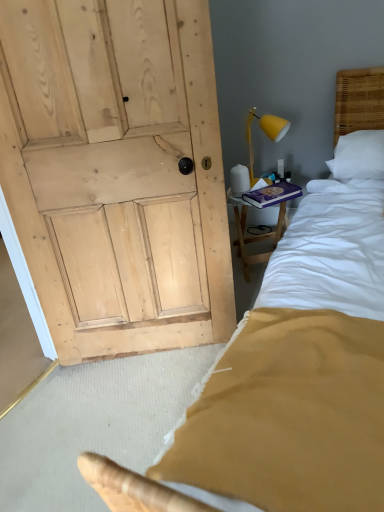
Measure the distance between point (300, 190) and camera.

Point (300, 190) and camera are 7.04 feet apart from each other.

The width and height of the screenshot is (384, 512). Find the location of `wooden bedside table at right`. wooden bedside table at right is located at coordinates (262, 232).

Identify the location of yellow matte lamp at upper right. The width and height of the screenshot is (384, 512). (x=265, y=133).

Where is `purple hardcover book at upper right`? The width and height of the screenshot is (384, 512). purple hardcover book at upper right is located at coordinates (272, 194).

Does point (289, 195) come in front of point (266, 182)?

Yes, it is.

Considering the relative sizes of purple hardcover book at upper right and yellow matte lamp at upper right in the image provided, is purple hardcover book at upper right bigger than yellow matte lamp at upper right?

Actually, purple hardcover book at upper right might be smaller than yellow matte lamp at upper right.

Is purple hardcover book at upper right at the right side of yellow matte lamp at upper right?

Yes, purple hardcover book at upper right is to the right of yellow matte lamp at upper right.

Is yellow matte lamp at upper right completely or partially inside purple hardcover book at upper right?

No.

In order to click on bedside lamp above the wooden bedside table at right (from a real-world perspective) in this screenshot , I will do `click(265, 133)`.

Which is more to the left, yellow matte lamp at upper right or wooden bedside table at right?

From the viewer's perspective, yellow matte lamp at upper right appears more on the left side.

Is the depth of yellow matte lamp at upper right less than that of wooden bedside table at right?

Yes, it is in front of wooden bedside table at right.

Does wooden bedside table at right turn towards yellow matte lamp at upper right?

No, wooden bedside table at right is not oriented towards yellow matte lamp at upper right.

From a real-world perspective, which is physically below, wooden bedside table at right or yellow matte lamp at upper right?

In real-world perspective, wooden bedside table at right is lower.

How different are the orientations of yellow matte lamp at upper right and purple hardcover book at upper right in degrees?

They differ by 70.4 degrees in their facing directions.

Is yellow matte lamp at upper right positioned far away from purple hardcover book at upper right?

No, yellow matte lamp at upper right is not far from purple hardcover book at upper right.

Find the location of `book behind the yellow matte lamp at upper right`. book behind the yellow matte lamp at upper right is located at coordinates (272, 194).

Between yellow matte lamp at upper right and purple hardcover book at upper right, which one is positioned in front?

yellow matte lamp at upper right.

Is purple hardcover book at upper right wider or thinner than wooden bedside table at right?

Clearly, purple hardcover book at upper right has less width compared to wooden bedside table at right.

Identify the location of furniture below the purple hardcover book at upper right (from the image's perspective). The width and height of the screenshot is (384, 512). (262, 232).

Can you confirm if purple hardcover book at upper right is smaller than wooden bedside table at right?

Indeed, purple hardcover book at upper right has a smaller size compared to wooden bedside table at right.

From a real-world perspective, is purple hardcover book at upper right beneath wooden bedside table at right?

No, from a real-world perspective, purple hardcover book at upper right is not beneath wooden bedside table at right.

From the image's perspective, which object appears higher, wooden bedside table at right or purple hardcover book at upper right?

purple hardcover book at upper right appears higher in the image.

What are the coordinates of `furniture behind the purple hardcover book at upper right` in the screenshot? It's located at [262, 232].

Is wooden bedside table at right facing away from purple hardcover book at upper right?

No, wooden bedside table at right is not facing the opposite direction of purple hardcover book at upper right.

The height and width of the screenshot is (512, 384). Identify the location of book that appears below the yellow matte lamp at upper right (from a real-world perspective). (272, 194).

This screenshot has height=512, width=384. What are the coordinates of `bedside lamp located above the wooden bedside table at right (from the image's perspective)` in the screenshot? It's located at (265, 133).

Based on their spatial positions, is purple hardcover book at upper right or yellow matte lamp at upper right further from wooden bedside table at right?

The object further to wooden bedside table at right is yellow matte lamp at upper right.

Which object lies further to the anchor point purple hardcover book at upper right, wooden bedside table at right or yellow matte lamp at upper right?

Among the two, yellow matte lamp at upper right is located further to purple hardcover book at upper right.

Which object lies further to the anchor point yellow matte lamp at upper right, wooden bedside table at right or purple hardcover book at upper right?

The object further to yellow matte lamp at upper right is purple hardcover book at upper right.

From the image, which object appears to be farther from yellow matte lamp at upper right, purple hardcover book at upper right or wooden bedside table at right?

purple hardcover book at upper right is further to yellow matte lamp at upper right.

Considering their positions, is yellow matte lamp at upper right positioned closer to wooden bedside table at right than purple hardcover book at upper right?

purple hardcover book at upper right is positioned closer to the anchor wooden bedside table at right.

Estimate the real-world distances between objects in this image. Which object is further from purple hardcover book at upper right, yellow matte lamp at upper right or wooden bedside table at right?

yellow matte lamp at upper right.

At what (x,y) coordinates should I click in order to perform the action: click on book between yellow matte lamp at upper right and wooden bedside table at right from top to bottom. Please return your answer as a coordinate pair (x, y). The width and height of the screenshot is (384, 512). Looking at the image, I should click on (272, 194).